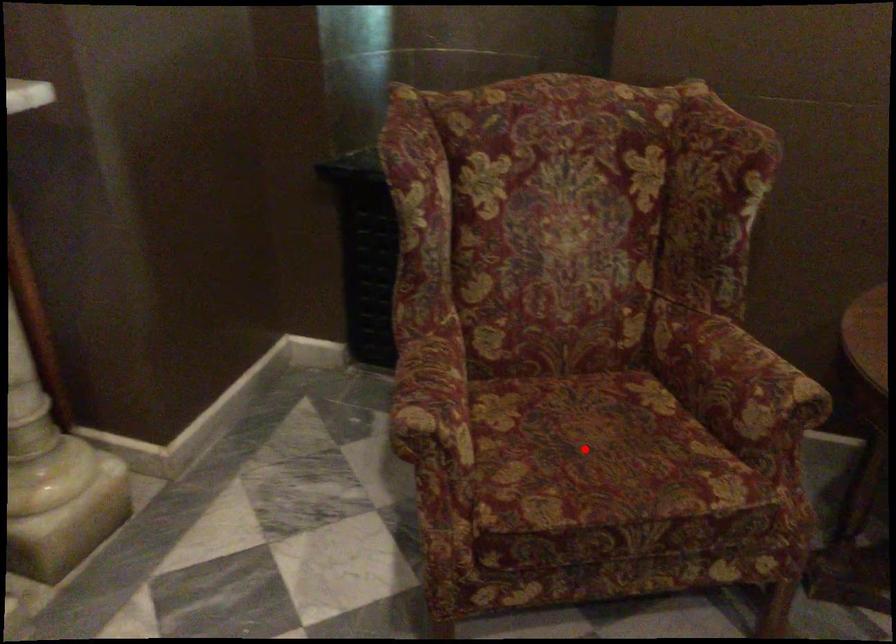
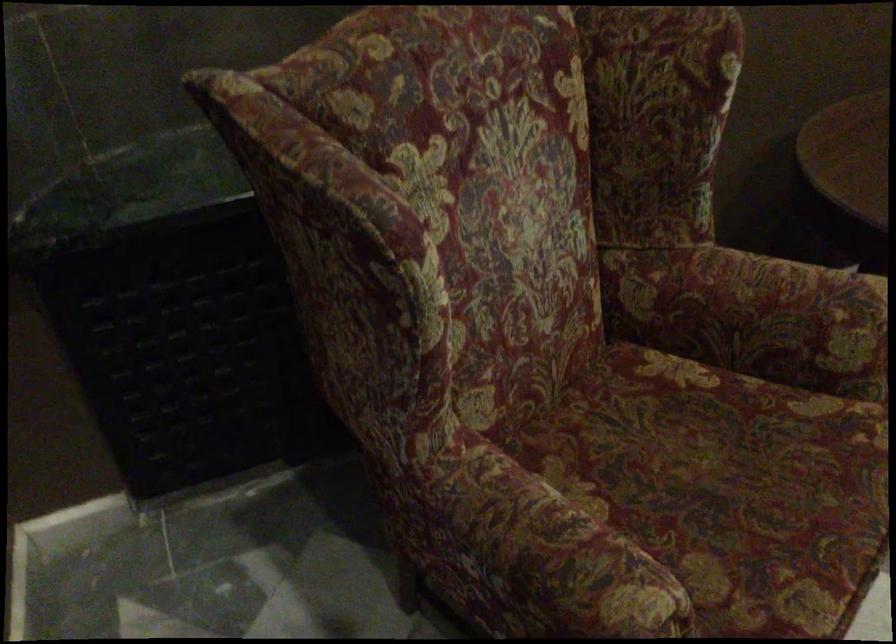
Locate, in the second image, the point that corresponds to the highlighted location in the first image.

(726, 486)